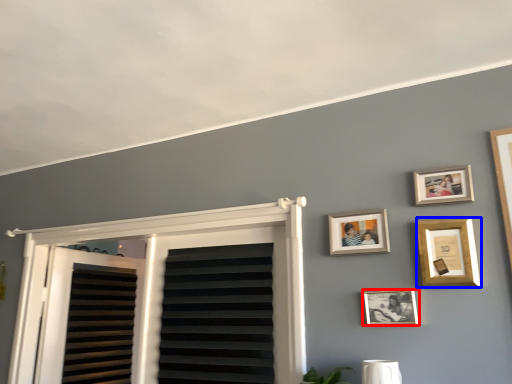
Question: Which object appears farthest to the camera in this image, picture frame (highlighted by a red box) or picture frame (highlighted by a blue box)?

Choices:
 (A) picture frame
 (B) picture frame

Answer: (A)